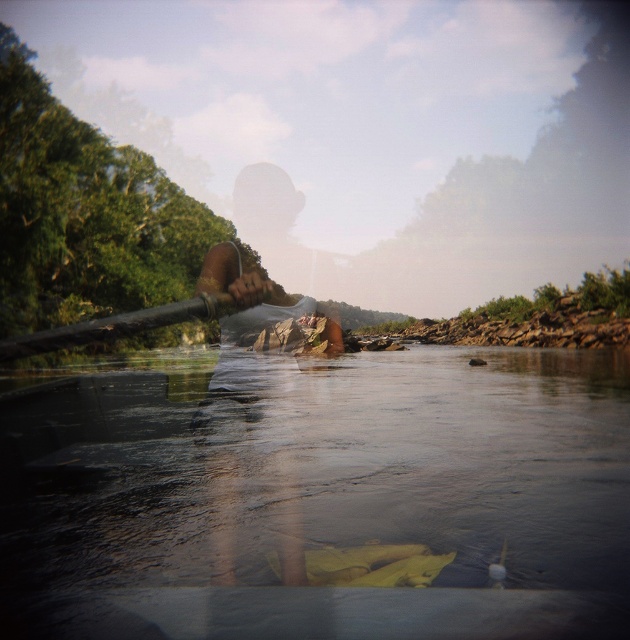
Does clear water at lower center have a greater height compared to brown leather paddle at center?

No, clear water at lower center is not taller than brown leather paddle at center.

Measure the distance between clear water at lower center and camera.

clear water at lower center is 11.37 feet away from camera.

What do you see at coordinates (319, 497) in the screenshot? The width and height of the screenshot is (630, 640). I see `clear water at lower center` at bounding box center [319, 497].

Find the location of a particular element. This screenshot has height=640, width=630. clear water at lower center is located at coordinates (319, 497).

Can you confirm if brown leather paddle at center is positioned to the left of wooden paddle at center?

In fact, brown leather paddle at center is to the right of wooden paddle at center.

Does point (258, 273) come closer to viewer compared to point (210, 317)?

No, it is behind (210, 317).

You are a GUI agent. You are given a task and a screenshot of the screen. Output one action in this format:
    pyautogui.click(x=<x>, y=<y>)
    Task: Click on the brown leather paddle at center
    The image size is (630, 640).
    Given the screenshot: What is the action you would take?
    pyautogui.click(x=246, y=288)

Which is more to the right, clear water at lower center or wooden paddle at center?

clear water at lower center is more to the right.

Which is below, clear water at lower center or wooden paddle at center?

clear water at lower center is lower down.

Is point (536, 552) less distant than point (260, 296)?

Yes, point (536, 552) is in front of point (260, 296).

Locate an element on the screen. clear water at lower center is located at coordinates pyautogui.click(x=319, y=497).